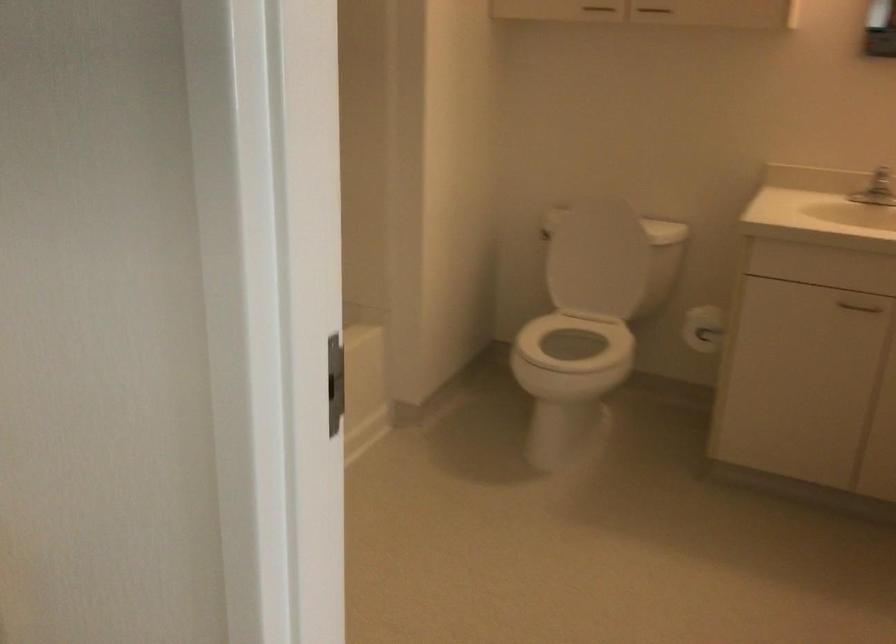
Find where to pull the vanity cabinet handle. Please return your answer as a coordinate pair (x, y).

(650, 12)